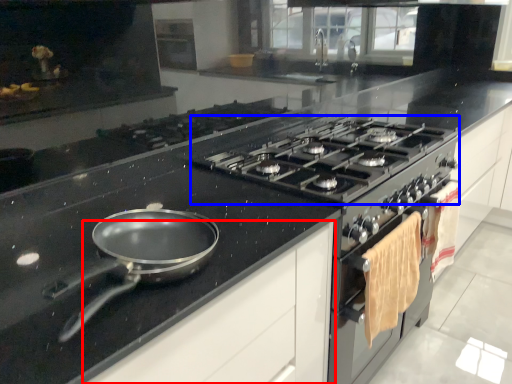
Question: Among these objects, which one is farthest to the camera, cabinetry (highlighted by a red box) or gas stove (highlighted by a blue box)?

Choices:
 (A) cabinetry
 (B) gas stove

Answer: (B)